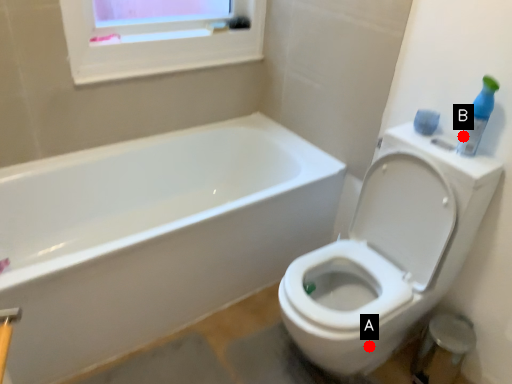
Question: Two points are circled on the image, labeled by A and B beside each circle. Among these points, which one is nearest to the camera?

Choices:
 (A) A is closer
 (B) B is closer

Answer: (B)